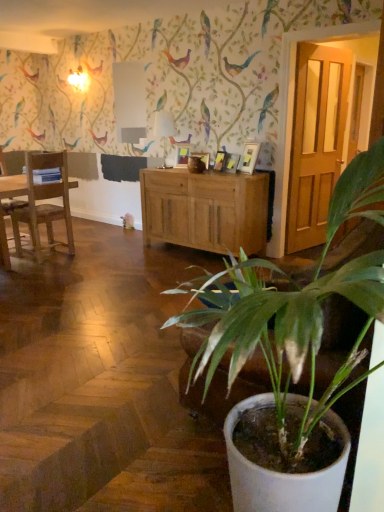
Question: From the image's perspective, is white glossy picture frame at upper center, the first picture frame from the right, located beneath matte wooden picture frame at center, placed as the third picture frame when sorted from front to back?

Choices:
 (A) no
 (B) yes

Answer: (B)

Question: Considering the relative positions of white glossy picture frame at upper center, the first picture frame from the right, and matte wooden picture frame at center, acting as the 1th picture frame starting from the left, in the image provided, is white glossy picture frame at upper center, the first picture frame from the right, to the right of matte wooden picture frame at center, acting as the 1th picture frame starting from the left, from the viewer's perspective?

Choices:
 (A) yes
 (B) no

Answer: (A)

Question: Can you confirm if white glossy picture frame at upper center, which is the 1th picture frame in front-to-back order, is bigger than matte wooden picture frame at center, arranged as the third picture frame when viewed from the right?

Choices:
 (A) no
 (B) yes

Answer: (B)

Question: Is the surface of white glossy picture frame at upper center, arranged as the third picture frame when viewed from the left, in direct contact with matte wooden picture frame at center, placed as the third picture frame when sorted from front to back?

Choices:
 (A) yes
 (B) no

Answer: (B)

Question: Considering the relative sizes of white glossy picture frame at upper center, arranged as the third picture frame when viewed from the left, and matte wooden picture frame at center, placed as the third picture frame when sorted from front to back, in the image provided, is white glossy picture frame at upper center, arranged as the third picture frame when viewed from the left, thinner than matte wooden picture frame at center, placed as the third picture frame when sorted from front to back,?

Choices:
 (A) yes
 (B) no

Answer: (A)

Question: Is point (177, 147) positioned closer to the camera than point (46, 156)?

Choices:
 (A) closer
 (B) farther

Answer: (B)

Question: Considering the positions of matte wooden picture frame at center, placed as the third picture frame when sorted from front to back, and wooden chair at left, positioned as the second chair in left-to-right order, in the image, is matte wooden picture frame at center, placed as the third picture frame when sorted from front to back, taller or shorter than wooden chair at left, positioned as the second chair in left-to-right order,?

Choices:
 (A) short
 (B) tall

Answer: (A)

Question: Considering the positions of matte wooden picture frame at center, placed as the third picture frame when sorted from front to back, and wooden chair at left, positioned as the second chair in left-to-right order, in the image, is matte wooden picture frame at center, placed as the third picture frame when sorted from front to back, wider or thinner than wooden chair at left, positioned as the second chair in left-to-right order,?

Choices:
 (A) wide
 (B) thin

Answer: (B)

Question: Considering the positions of matte wooden picture frame at center, arranged as the third picture frame when viewed from the right, and wooden chair at left, positioned as the second chair in left-to-right order, in the image, is matte wooden picture frame at center, arranged as the third picture frame when viewed from the right, bigger or smaller than wooden chair at left, positioned as the second chair in left-to-right order,?

Choices:
 (A) big
 (B) small

Answer: (B)

Question: From a real-world perspective, relative to matte wooden picture frame at center, arranged as the third picture frame when viewed from the right, is light brown wood cabinet at center vertically above or below?

Choices:
 (A) above
 (B) below

Answer: (B)

Question: Is light brown wood cabinet at center wider or thinner than matte wooden picture frame at center, placed as the first picture frame when sorted from back to front?

Choices:
 (A) wide
 (B) thin

Answer: (A)

Question: Would you say light brown wood cabinet at center is inside or outside matte wooden picture frame at center, acting as the 1th picture frame starting from the left?

Choices:
 (A) inside
 (B) outside

Answer: (B)

Question: Considering the positions of light brown wood cabinet at center and matte wooden picture frame at center, arranged as the third picture frame when viewed from the right, in the image, is light brown wood cabinet at center taller or shorter than matte wooden picture frame at center, arranged as the third picture frame when viewed from the right,?

Choices:
 (A) tall
 (B) short

Answer: (A)

Question: Considering the positions of white glossy lampshade at center and white glossy picture frame at upper center, the first picture frame from the right, in the image, is white glossy lampshade at center taller or shorter than white glossy picture frame at upper center, the first picture frame from the right,?

Choices:
 (A) short
 (B) tall

Answer: (B)

Question: In terms of width, does white glossy lampshade at center look wider or thinner when compared to white glossy picture frame at upper center, which is the third picture frame in back-to-front order?

Choices:
 (A) thin
 (B) wide

Answer: (B)